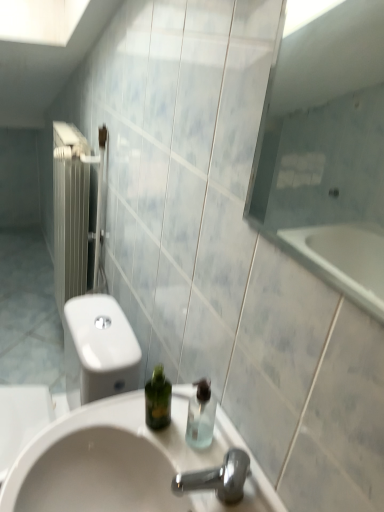
Locate an element on the screen. vacant point to the left of transparent plastic soap dispenser at center is located at coordinates (144, 423).